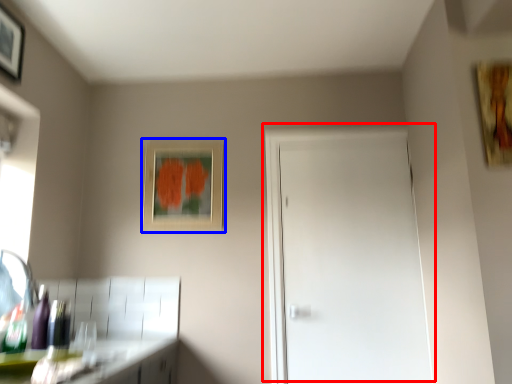
Question: Among these objects, which one is farthest to the camera, door (highlighted by a red box) or picture frame (highlighted by a blue box)?

Choices:
 (A) door
 (B) picture frame

Answer: (B)